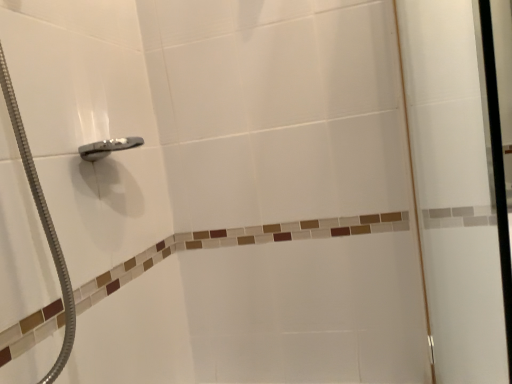
Question: Should I look upward or downward to see transparent glass screen door at right?

Choices:
 (A) down
 (B) up

Answer: (A)